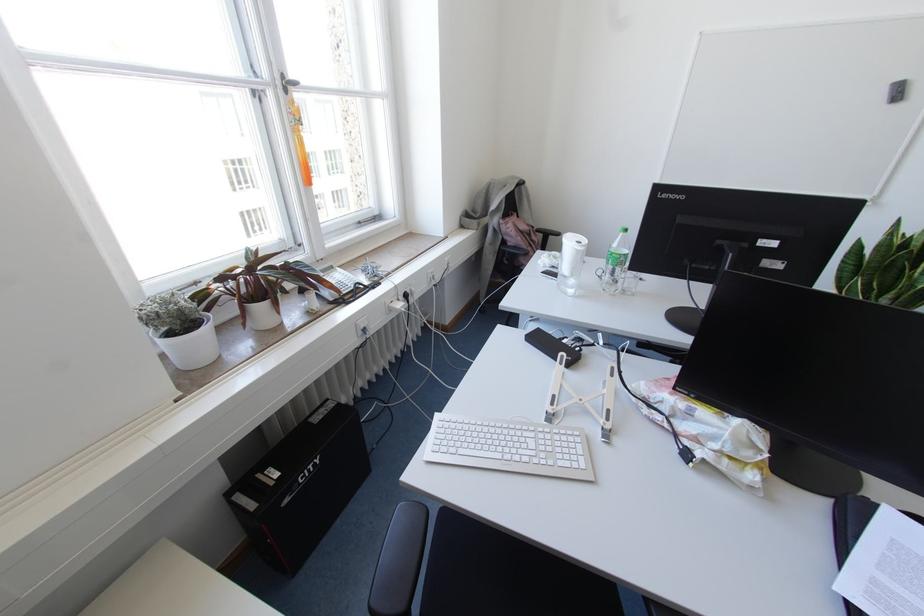
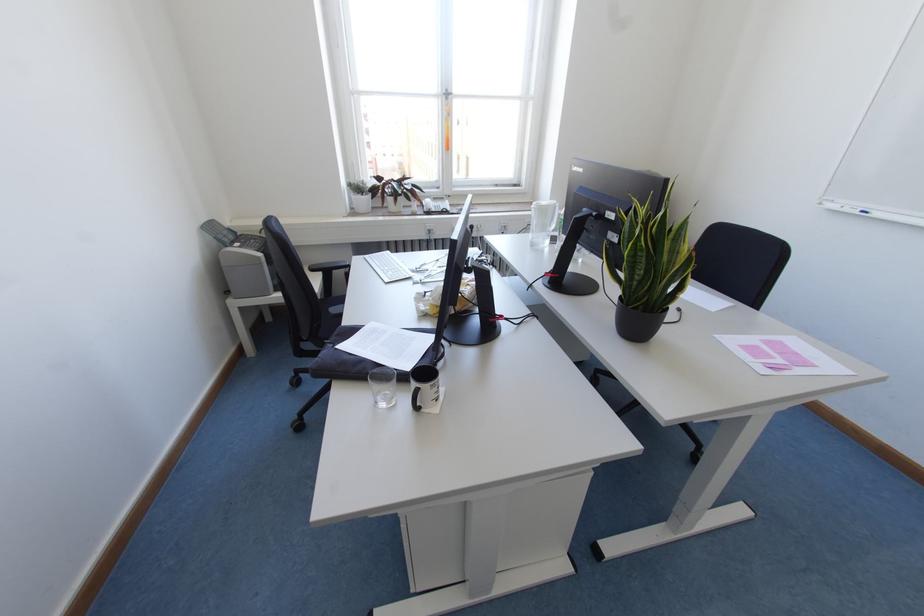
In the second image, find the point that corresponds to (186,326) in the first image.

(361, 195)